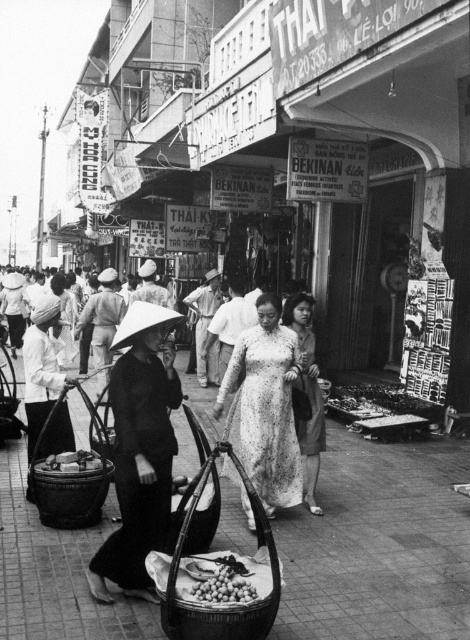
Question: Which of the following is the farthest from the observer?

Choices:
 (A) (48, 464)
 (B) (242, 576)

Answer: (A)

Question: Does white lace dress at center have a lesser width compared to smooth brown nuts at center?

Choices:
 (A) yes
 (B) no

Answer: (B)

Question: Among these points, which one is nearest to the camera?

Choices:
 (A) (103, 465)
 (B) (288, 314)
 (C) (221, 580)

Answer: (C)

Question: Is black matte conical hat at center below white lace dress at center?

Choices:
 (A) no
 (B) yes

Answer: (B)

Question: Is the position of white lace dress at center less distant than that of smooth brown fruit at lower left?

Choices:
 (A) no
 (B) yes

Answer: (A)

Question: Which object is closer to the camera taking this photo?

Choices:
 (A) black matte conical hat at center
 (B) smooth brown fruit at lower left
 (C) white floral dress at center

Answer: (A)